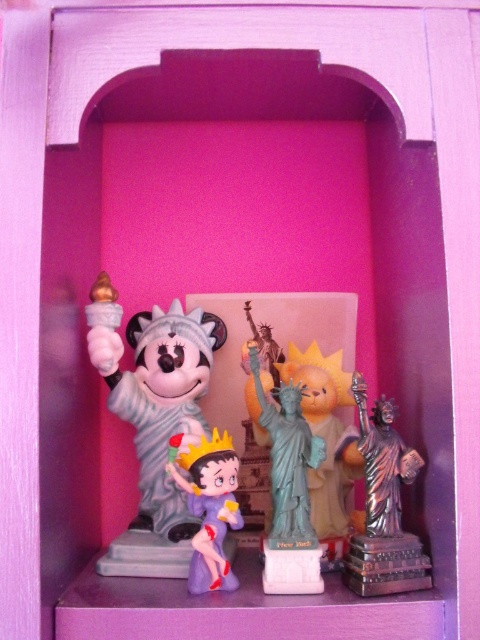
Question: Which of the following is the closest to the observer?

Choices:
 (A) matte gray statue at center
 (B) silver metallic statue at center
 (C) green matte statue of liberty at center

Answer: (B)

Question: Observing the image, what is the correct spatial positioning of matte plastic minnie mouse statue at center in reference to green matte statue of liberty at center?

Choices:
 (A) above
 (B) below

Answer: (A)

Question: Does silver metallic statue at center come in front of green matte statue of liberty at center?

Choices:
 (A) yes
 (B) no

Answer: (A)

Question: Does matte plastic minnie mouse statue at center have a smaller size compared to matte plastic betty boop at center?

Choices:
 (A) no
 (B) yes

Answer: (A)

Question: Based on their relative distances, which object is farther from the green matte statue of liberty at center?

Choices:
 (A) matte gray statue at center
 (B) matte plastic betty boop at center
 (C) matte plastic minnie mouse statue at center

Answer: (A)

Question: Among these points, which one is farthest from the camera?

Choices:
 (A) (207, 522)
 (B) (392, 577)
 (C) (288, 580)

Answer: (A)